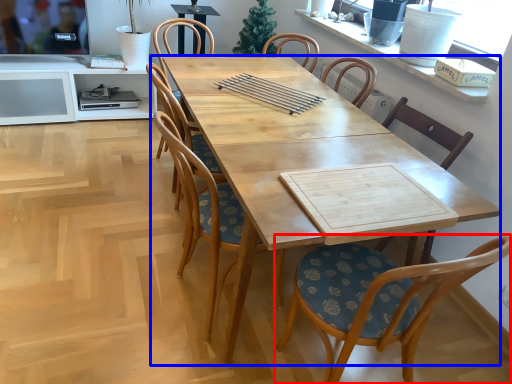
Question: Among these objects, which one is farthest to the camera, chair (highlighted by a red box) or desk (highlighted by a blue box)?

Choices:
 (A) chair
 (B) desk

Answer: (B)